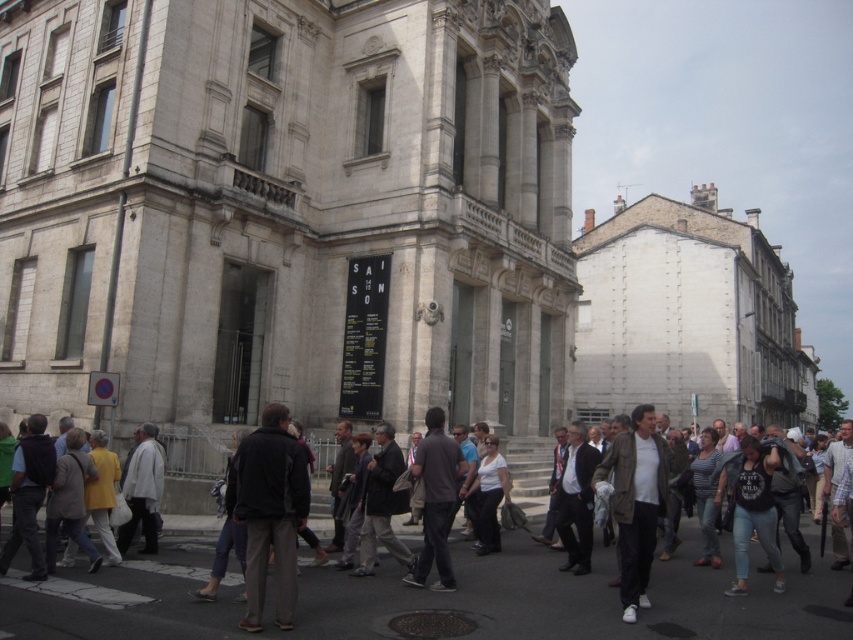
From the picture: Does light yellow jacket at center appear over brown fabric shirt at center?

Actually, light yellow jacket at center is below brown fabric shirt at center.

Does light yellow jacket at center appear on the right side of brown fabric shirt at center?

Incorrect, light yellow jacket at center is not on the right side of brown fabric shirt at center.

Does point (97, 561) come farther from viewer compared to point (442, 557)?

Yes, it is behind point (442, 557).

At what (x,y) coordinates should I click in order to perform the action: click on light yellow jacket at center. Please return your answer as a coordinate pair (x, y). Looking at the image, I should click on (51, 504).

Locate an element on the screen. The width and height of the screenshot is (853, 640). brown fabric shirt at center is located at coordinates (436, 500).

Which is below, brown fabric shirt at center or dark gray jacket at center?

dark gray jacket at center

Is point (434, 428) closer to camera compared to point (380, 490)?

No, (434, 428) is behind (380, 490).

The width and height of the screenshot is (853, 640). In order to click on brown fabric shirt at center in this screenshot , I will do `click(436, 500)`.

Which of these two, dark gray pants at center or light yellow jacket at center, stands taller?

With more height is dark gray pants at center.

Where is `dark gray pants at center`? The height and width of the screenshot is (640, 853). dark gray pants at center is located at coordinates (270, 512).

Does point (279, 529) come in front of point (70, 483)?

Yes, point (279, 529) is closer to viewer.

Where is `dark gray pants at center`? dark gray pants at center is located at coordinates (270, 512).